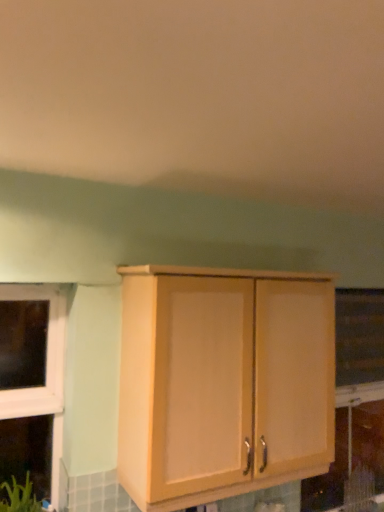
Where is `transparent plastic window screen at right`? The image size is (384, 512). transparent plastic window screen at right is located at coordinates (359, 336).

What is the approximate height of transparent plastic window screen at right?

It is 22.33 inches.

This screenshot has width=384, height=512. Describe the element at coordinates (359, 336) in the screenshot. I see `transparent plastic window screen at right` at that location.

The height and width of the screenshot is (512, 384). Describe the element at coordinates (223, 382) in the screenshot. I see `light wood cabinet at center` at that location.

Image resolution: width=384 pixels, height=512 pixels. What are the coordinates of `light wood cabinet at center` in the screenshot? It's located at (223, 382).

Image resolution: width=384 pixels, height=512 pixels. What are the coordinates of `transparent plastic window screen at right` in the screenshot? It's located at (359, 336).

Between transparent plastic window screen at right and light wood cabinet at center, which one appears on the right side from the viewer's perspective?

transparent plastic window screen at right is more to the right.

Considering the relative positions of transparent plastic window screen at right and light wood cabinet at center in the image provided, is transparent plastic window screen at right behind light wood cabinet at center?

Yes, transparent plastic window screen at right is further from the viewer.

Considering the points (355, 302) and (160, 301), which point is behind, point (355, 302) or point (160, 301)?

The point (355, 302) is farther.

From the image's perspective, is transparent plastic window screen at right located beneath light wood cabinet at center?

Yes, from the image's perspective, transparent plastic window screen at right is beneath light wood cabinet at center.

From a real-world perspective, is transparent plastic window screen at right positioned above or below light wood cabinet at center?

Clearly, from a real-world perspective, transparent plastic window screen at right is above light wood cabinet at center.

Which of these two, transparent plastic window screen at right or light wood cabinet at center, is thinner?

transparent plastic window screen at right.

Between transparent plastic window screen at right and light wood cabinet at center, which one has more height?

Standing taller between the two is light wood cabinet at center.

Based on their sizes in the image, would you say transparent plastic window screen at right is bigger or smaller than light wood cabinet at center?

Considering their sizes, transparent plastic window screen at right takes up less space than light wood cabinet at center.

Do you think transparent plastic window screen at right is within light wood cabinet at center, or outside of it?

transparent plastic window screen at right is outside light wood cabinet at center.

Is transparent plastic window screen at right far from light wood cabinet at center?

Yes, transparent plastic window screen at right and light wood cabinet at center are located far from each other.

Is transparent plastic window screen at right oriented away from light wood cabinet at center?

transparent plastic window screen at right is not turned away from light wood cabinet at center.

How many degrees apart are the facing directions of transparent plastic window screen at right and light wood cabinet at center?

0.432 degrees.

Where is `cabinetry above the transparent plastic window screen at right (from the image's perspective)`? The image size is (384, 512). cabinetry above the transparent plastic window screen at right (from the image's perspective) is located at coordinates (223, 382).

Looking at this image, is light wood cabinet at center to the left or to the right of transparent plastic window screen at right in the image?

light wood cabinet at center is to the left of transparent plastic window screen at right.

Considering the relative positions of light wood cabinet at center and transparent plastic window screen at right in the image provided, is light wood cabinet at center behind transparent plastic window screen at right?

No, light wood cabinet at center is in front of transparent plastic window screen at right.

Which point is more forward, (299,316) or (372,337)?

The point (299,316) is more forward.

From the image's perspective, is light wood cabinet at center below transparent plastic window screen at right?

No, from the image's perspective, light wood cabinet at center is not below transparent plastic window screen at right.

From a real-world perspective, is light wood cabinet at center on transparent plastic window screen at right?

Incorrect, from a real-world perspective, light wood cabinet at center is lower than transparent plastic window screen at right.

Is light wood cabinet at center thinner than transparent plastic window screen at right?

In fact, light wood cabinet at center might be wider than transparent plastic window screen at right.

From their relative heights in the image, would you say light wood cabinet at center is taller or shorter than transparent plastic window screen at right?

Clearly, light wood cabinet at center is taller compared to transparent plastic window screen at right.

Considering the relative sizes of light wood cabinet at center and transparent plastic window screen at right in the image provided, is light wood cabinet at center bigger than transparent plastic window screen at right?

Indeed, light wood cabinet at center has a larger size compared to transparent plastic window screen at right.

Is light wood cabinet at center completely or partially outside of transparent plastic window screen at right?

light wood cabinet at center is positioned outside transparent plastic window screen at right.

Can you see light wood cabinet at center touching transparent plastic window screen at right?

No.

Is light wood cabinet at center oriented away from transparent plastic window screen at right?

light wood cabinet at center is not turned away from transparent plastic window screen at right.

Can you tell me how much light wood cabinet at center and transparent plastic window screen at right differ in facing direction?

The angle between the facing direction of light wood cabinet at center and the facing direction of transparent plastic window screen at right is 0.432 degrees.

I want to click on cabinetry on the left of transparent plastic window screen at right, so click(223, 382).

Locate an element on the screen. The height and width of the screenshot is (512, 384). window screen lying on the right of light wood cabinet at center is located at coordinates (359, 336).

Where is `cabinetry on the left side of transparent plastic window screen at right`? Image resolution: width=384 pixels, height=512 pixels. cabinetry on the left side of transparent plastic window screen at right is located at coordinates 223,382.